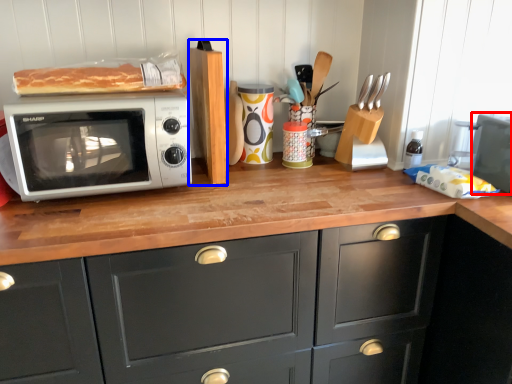
Question: Which point is closer to the camera, appliance (highlighted by a red box) or wood (highlighted by a blue box)?

Choices:
 (A) appliance
 (B) wood

Answer: (A)